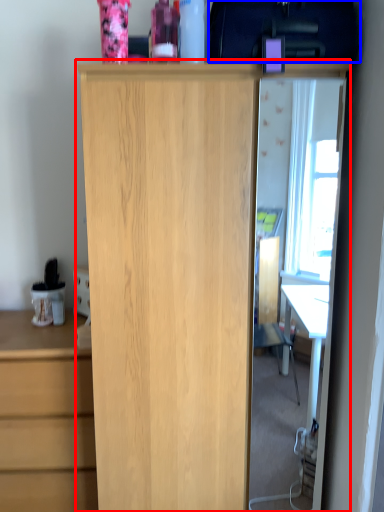
Question: Which object appears farthest to the camera in this image, cupboard (highlighted by a red box) or back (highlighted by a blue box)?

Choices:
 (A) cupboard
 (B) back

Answer: (A)